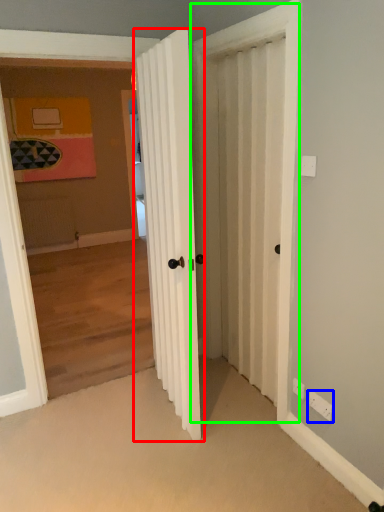
Question: Estimate the real-world distances between objects in this image. Which object is closer to door (highlighted by a red box), electric outlet (highlighted by a blue box) or screen door (highlighted by a green box)?

Choices:
 (A) electric outlet
 (B) screen door

Answer: (B)